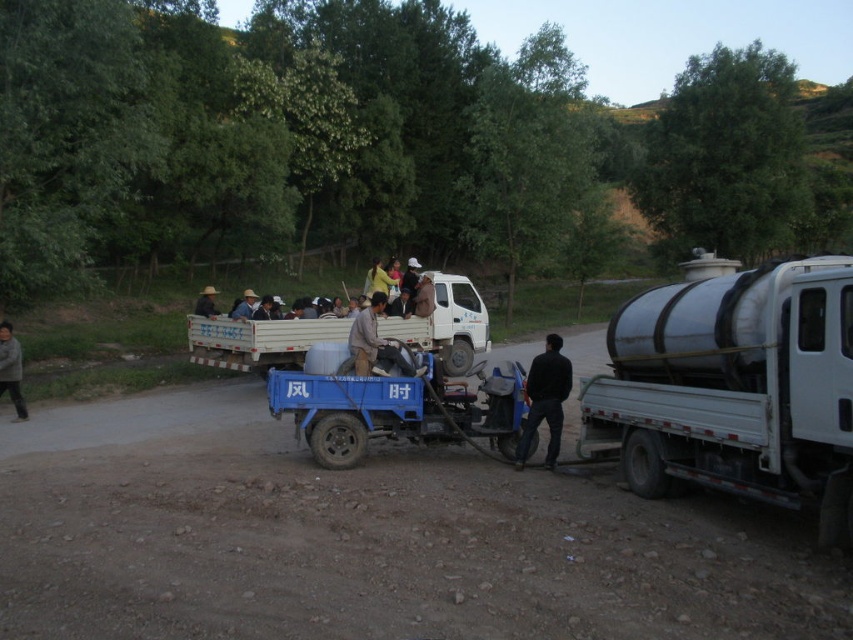
You are a delivery person who needs to load a package into either the blue plastic wagon at center or the light brown leather jacket at center. Which one can accommodate the package if it requires more vertical space?

The blue plastic wagon at center is taller than the light brown leather jacket at center, so the package requiring more vertical space should be placed in the blue plastic wagon at center.

You are a photographer trying to capture a candid shot of the group without them noticing. You have a camera with a zoom lens. You see the light brown leather jacket at center and the light brown fabric hat at center in your viewfinder. Which object should you focus on to ensure the subject is in focus without adjusting the zoom, considering their sizes in the frame?

The light brown leather jacket at center has a lesser height compared to the light brown fabric hat at center. Therefore, you should focus on the light brown fabric hat at center since it is taller and more likely to be in focus without adjusting the zoom.